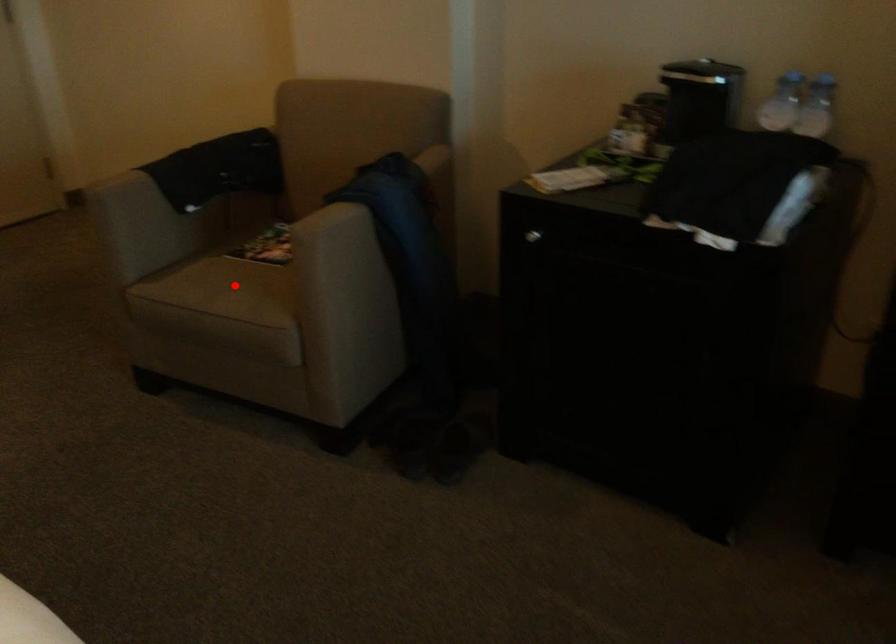
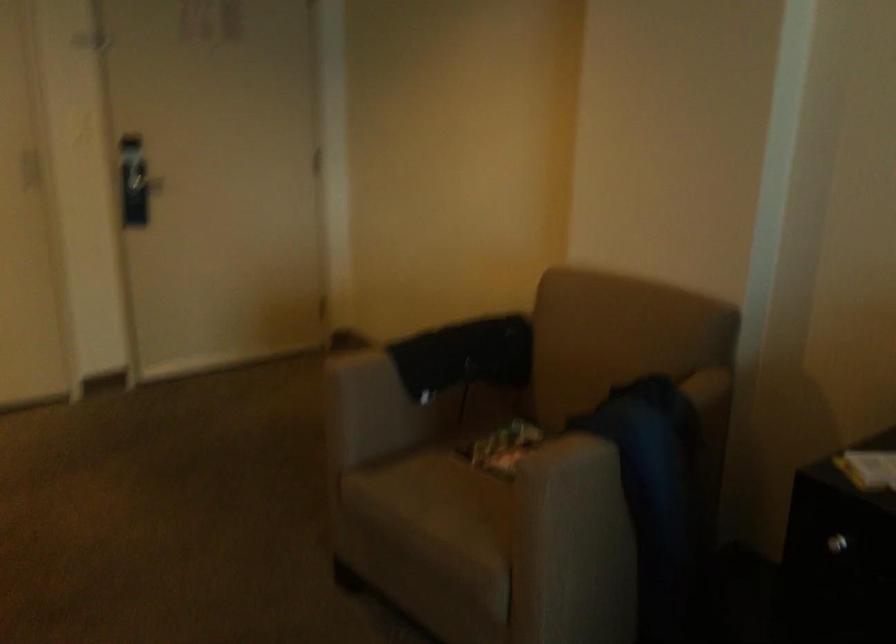
Question: I am providing you with two images of the same scene from different viewpoints. In image1, a red point is highlighted. Considering the same 3D point in image2, which of the following is correct?

Choices:
 (A) It is closer
 (B) It is farther

Answer: (A)